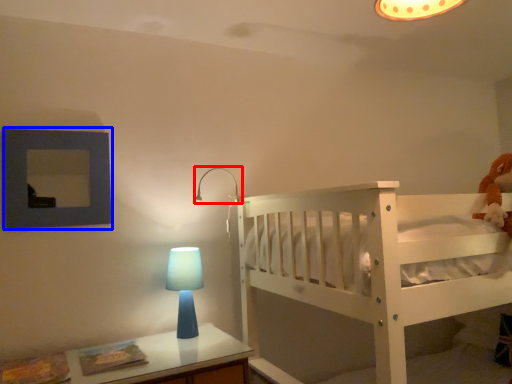
Question: Which of the following is the closest to the observer, lamp (highlighted by a red box) or picture frame (highlighted by a blue box)?

Choices:
 (A) lamp
 (B) picture frame

Answer: (B)